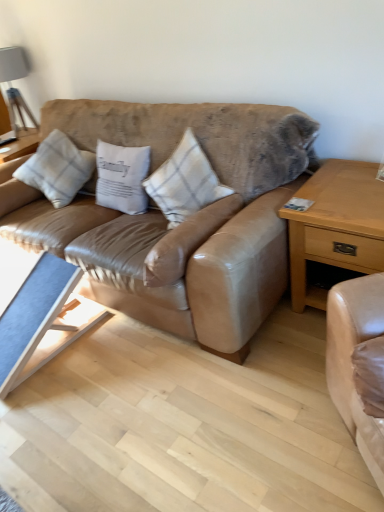
Question: Does matte gray lampshade at upper left come in front of white cotton pillow at center, which is counted as the second pillow, starting from the right?

Choices:
 (A) no
 (B) yes

Answer: (A)

Question: Is white cotton pillow at center, the 2th pillow from the left, located within matte gray lampshade at upper left?

Choices:
 (A) yes
 (B) no

Answer: (B)

Question: From a real-world perspective, is matte gray lampshade at upper left on white cotton pillow at center, the 2th pillow from the left?

Choices:
 (A) no
 (B) yes

Answer: (B)

Question: Is matte gray lampshade at upper left smaller than white cotton pillow at center, which is counted as the second pillow, starting from the right?

Choices:
 (A) yes
 (B) no

Answer: (B)

Question: Is matte gray lampshade at upper left bigger than white cotton pillow at center, which is counted as the second pillow, starting from the right?

Choices:
 (A) yes
 (B) no

Answer: (A)

Question: Is matte gray lampshade at upper left taller or shorter than white plaid pillow at center, which is counted as the 3th pillow, starting from the right?

Choices:
 (A) tall
 (B) short

Answer: (A)

Question: Is matte gray lampshade at upper left bigger or smaller than white plaid pillow at center, the first pillow in the left-to-right sequence?

Choices:
 (A) big
 (B) small

Answer: (B)

Question: In the image, is matte gray lampshade at upper left positioned in front of or behind white plaid pillow at center, which is counted as the 3th pillow, starting from the right?

Choices:
 (A) front
 (B) behind

Answer: (B)

Question: Considering the relative positions of matte gray lampshade at upper left and white plaid pillow at center, the first pillow in the left-to-right sequence, in the image provided, is matte gray lampshade at upper left to the left or to the right of white plaid pillow at center, the first pillow in the left-to-right sequence,?

Choices:
 (A) left
 (B) right

Answer: (A)

Question: Relative to white plaid pillow at center, which is counted as the 3th pillow, starting from the right, is blue fabric coffee table at lower left in front or behind?

Choices:
 (A) front
 (B) behind

Answer: (A)

Question: Considering the positions of blue fabric coffee table at lower left and white plaid pillow at center, the first pillow in the left-to-right sequence, in the image, is blue fabric coffee table at lower left bigger or smaller than white plaid pillow at center, the first pillow in the left-to-right sequence,?

Choices:
 (A) small
 (B) big

Answer: (B)

Question: Is blue fabric coffee table at lower left inside or outside of white plaid pillow at center, the first pillow in the left-to-right sequence?

Choices:
 (A) outside
 (B) inside

Answer: (A)

Question: In terms of height, does blue fabric coffee table at lower left look taller or shorter compared to white plaid pillow at center, which is counted as the 3th pillow, starting from the right?

Choices:
 (A) tall
 (B) short

Answer: (B)

Question: Is matte gray lampshade at upper left in front of or behind leather couch at center in the image?

Choices:
 (A) behind
 (B) front

Answer: (A)

Question: In terms of size, does matte gray lampshade at upper left appear bigger or smaller than leather couch at center?

Choices:
 (A) small
 (B) big

Answer: (A)